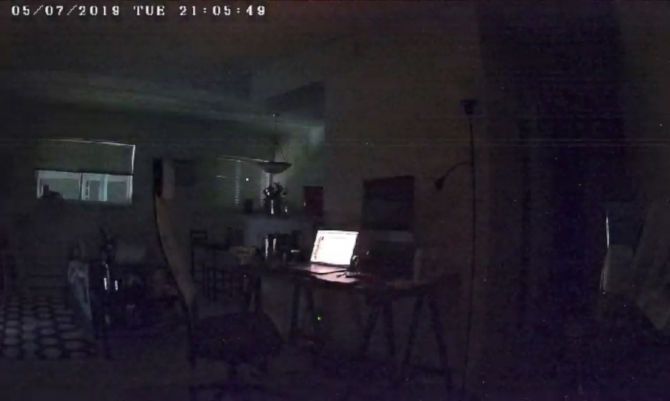
At what (x,y) coordinates should I click in order to perform the action: click on floor. Please return your answer as a coordinate pair (x, y). Looking at the image, I should click on (43, 331).